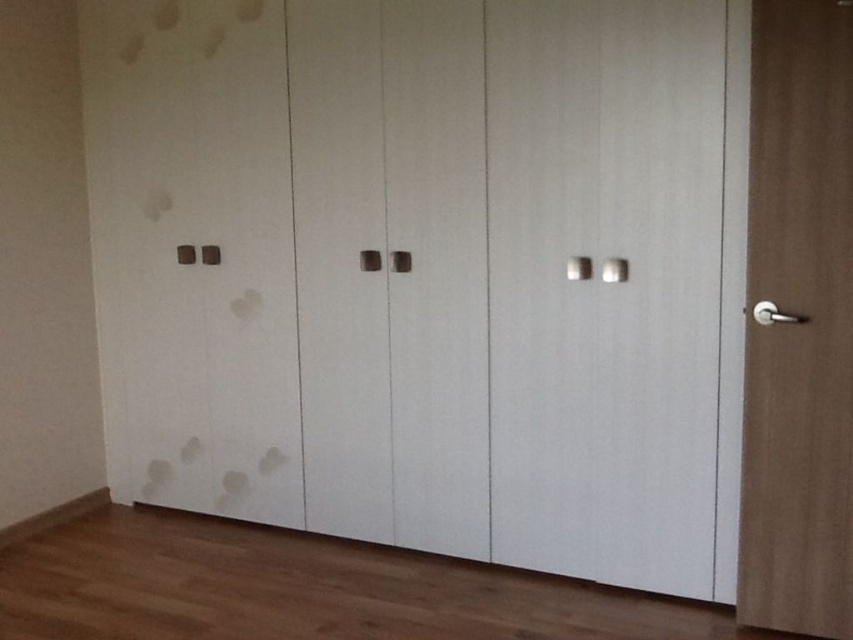
Question: Does white matte door at center have a lesser width compared to brown wood door at right?

Choices:
 (A) no
 (B) yes

Answer: (A)

Question: Is matte white door at left wider than brown wood door at right?

Choices:
 (A) yes
 (B) no

Answer: (A)

Question: Is white matte door at center positioned before brown wood door at right?

Choices:
 (A) yes
 (B) no

Answer: (B)

Question: Which of these objects is positioned closest to the white matte door at center?

Choices:
 (A) matte white door at left
 (B) brown wood door at right

Answer: (B)

Question: Which object is closer to the camera taking this photo?

Choices:
 (A) brown wood door at right
 (B) matte white door at left
 (C) white matte door at center

Answer: (A)

Question: Among these points, which one is farthest from the camera?

Choices:
 (A) (532, 550)
 (B) (186, 467)

Answer: (B)